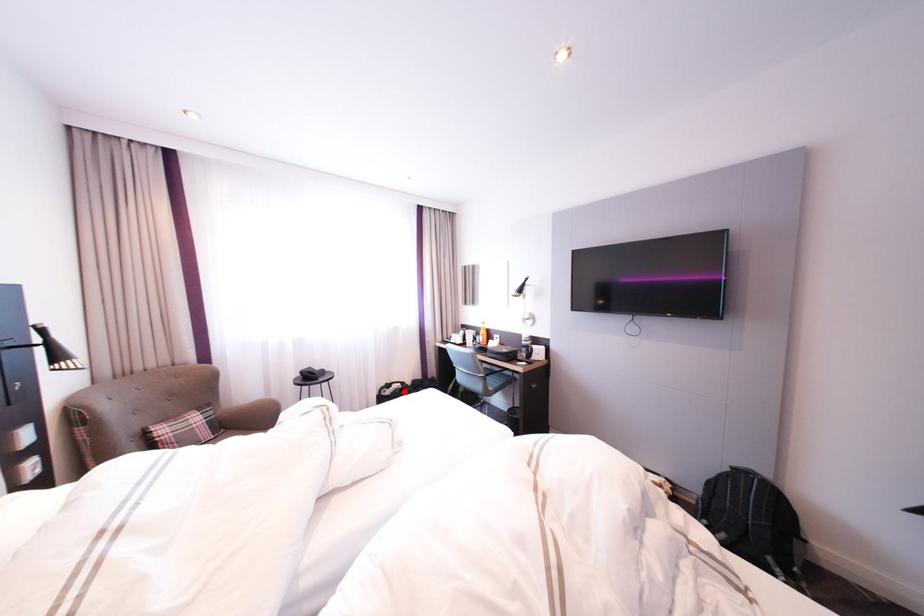
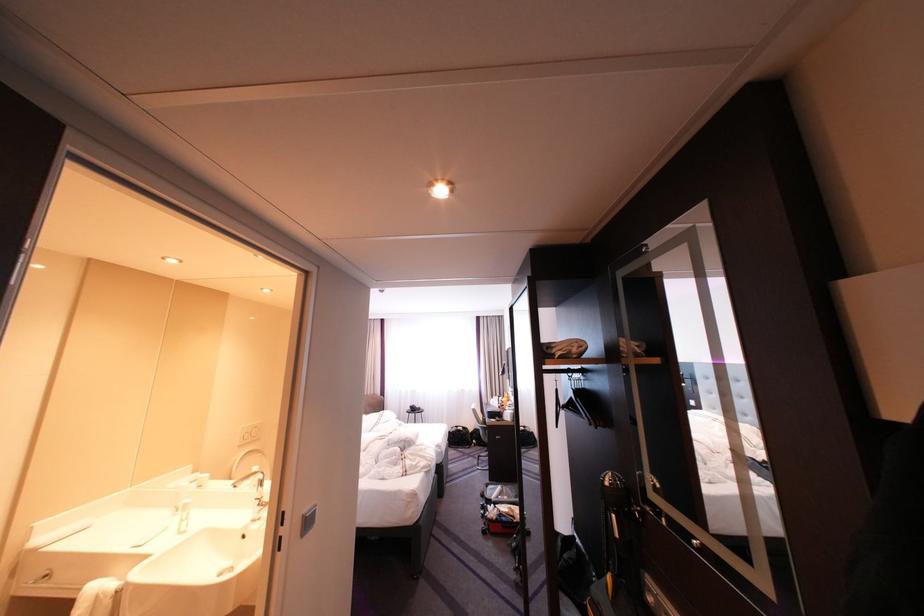
The point at the highlighted location is marked in the first image. Where is the corresponding point in the second image?

(467, 431)